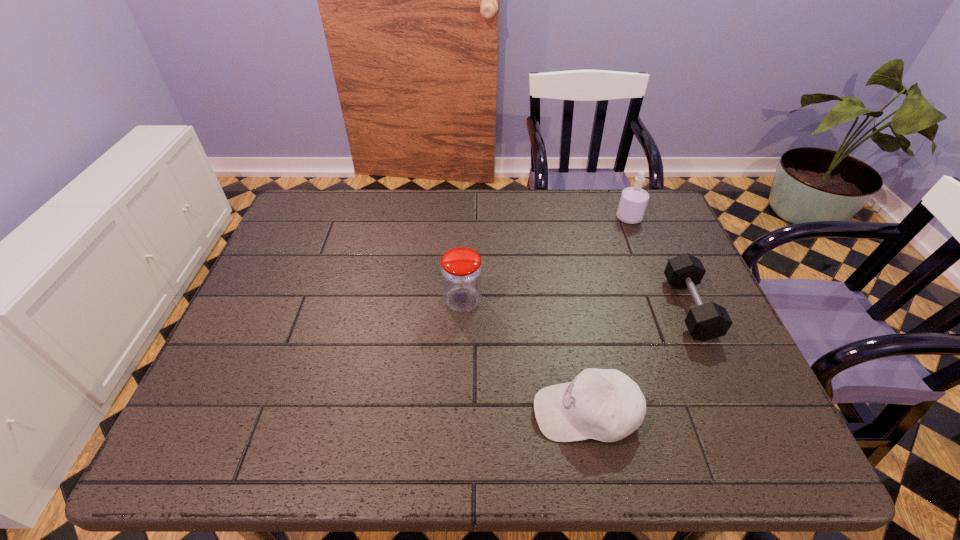
The image size is (960, 540). I want to click on unoccupied position between the farthest object and the shortest object, so click(660, 263).

I want to click on object that ranks as the third closest to the perfume, so click(x=603, y=404).

Choose which object is the nearest neighbor to the dumbbell. Please provide its 2D coordinates. Your answer should be formatted as a tuple, i.e. [(x, y)], where the tuple contains the x and y coordinates of a point satisfying the conditions above.

[(603, 404)]

You are a GUI agent. You are given a task and a screenshot of the screen. Output one action in this format:
    pyautogui.click(x=<x>, y=<y>)
    Task: Click on the vacant area in the image that satisfies the following two spatial constraints: 1. on the back side of the jar; 2. on the right side of the farthest object
    This screenshot has height=540, width=960.
    Given the screenshot: What is the action you would take?
    pyautogui.click(x=466, y=218)